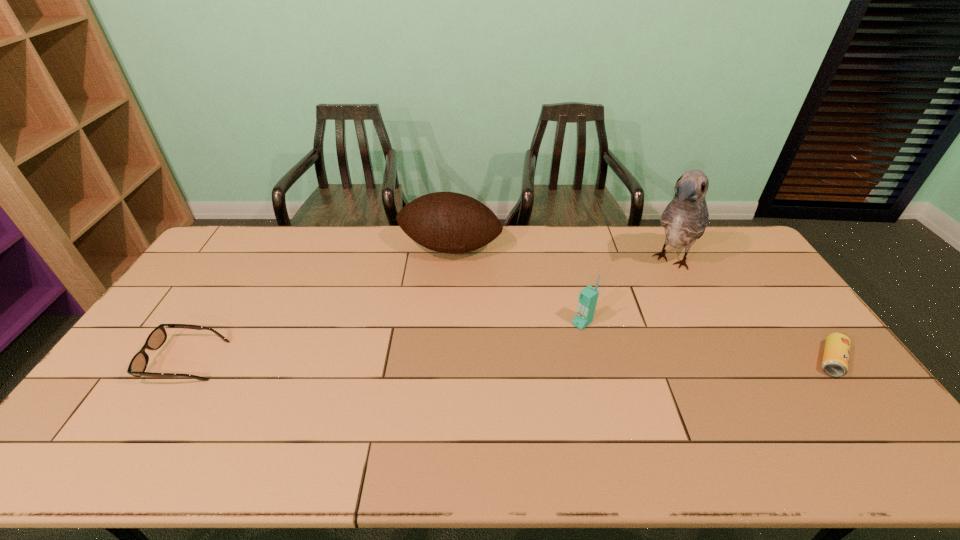
You are a GUI agent. You are given a task and a screenshot of the screen. Output one action in this format:
    pyautogui.click(x=<x>, y=<y>)
    Task: Click on the free spot between the third object from left to right and the shortest object
    This screenshot has height=540, width=960.
    Given the screenshot: What is the action you would take?
    pyautogui.click(x=707, y=341)

Where is `free space between the third farthest object and the rightmost object`? This screenshot has width=960, height=540. free space between the third farthest object and the rightmost object is located at coordinates (707, 341).

The width and height of the screenshot is (960, 540). Identify the location of empty space that is in between the shortest object and the tallest object. (752, 310).

Where is `vacant area that lies between the third tallest object and the parrot`? The height and width of the screenshot is (540, 960). vacant area that lies between the third tallest object and the parrot is located at coordinates (627, 292).

What are the coordinates of `vacant region between the second object from right to left and the third farthest object` in the screenshot? It's located at (627, 292).

Identify the location of vacant space that's between the parrot and the third object from left to right. Image resolution: width=960 pixels, height=540 pixels. (627, 292).

Locate an element on the screen. vacant space that is in between the leftmost object and the second object from left to right is located at coordinates (318, 305).

The image size is (960, 540). In order to click on unoccupied area between the shortest object and the cellular telephone in this screenshot , I will do `click(707, 341)`.

At what (x,y) coordinates should I click in order to perform the action: click on vacant space that is in between the second shortest object and the third object from right to left. Please return your answer as a coordinate pair (x, y). Looking at the image, I should click on (384, 342).

This screenshot has height=540, width=960. I want to click on object identified as the second closest to the second object from right to left, so click(835, 361).